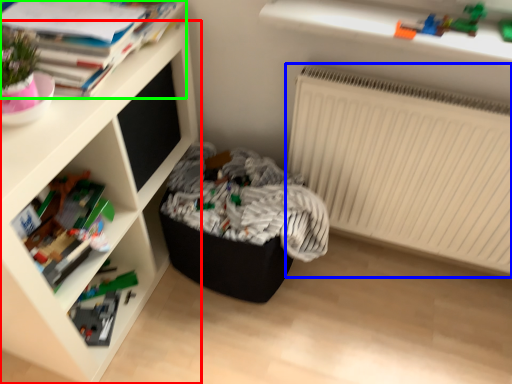
Question: Based on their relative distances, which object is nearer to shelf (highlighted by a red box)? Choose from radiator (highlighted by a blue box) and book (highlighted by a green box).

Choices:
 (A) radiator
 (B) book

Answer: (B)